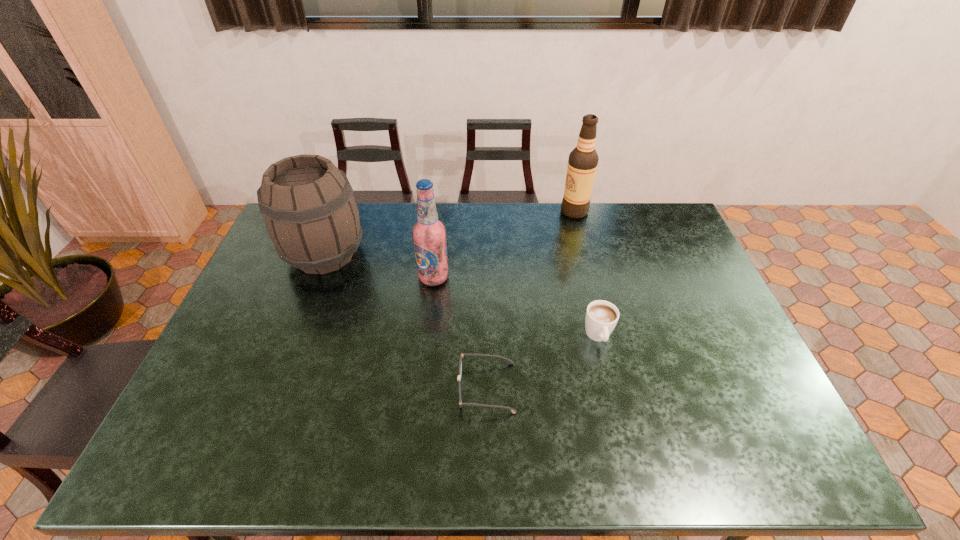
What are the coordinates of `vacant space that's between the left alcohol and the spectacles` in the screenshot? It's located at (460, 333).

Where is `vacant space in between the fourth object from right to left and the spectacles`? vacant space in between the fourth object from right to left and the spectacles is located at coordinates (460, 333).

Identify the location of vacant area that lies between the spectacles and the left alcohol. click(x=460, y=333).

Find the location of a particular element. vacant area that lies between the cappuccino and the spectacles is located at coordinates (542, 362).

Find the location of a particular element. The image size is (960, 540). vacant area that lies between the farthest object and the nearest object is located at coordinates (530, 299).

Where is `vacant space in between the spectacles and the second object from left to right`? The image size is (960, 540). vacant space in between the spectacles and the second object from left to right is located at coordinates (460, 333).

Locate an element on the screen. vacant region between the farther alcohol and the fourth tallest object is located at coordinates (587, 274).

Identify which object is the third nearest to the shortest object. Please provide its 2D coordinates. Your answer should be formatted as a tuple, i.e. [(x, y)], where the tuple contains the x and y coordinates of a point satisfying the conditions above.

[(311, 216)]

The width and height of the screenshot is (960, 540). I want to click on object that is the fourth closest to the spectacles, so click(582, 164).

Identify the location of free spot that satisfies the following two spatial constraints: 1. with the handle on the side of the cappuccino; 2. on the face of the shortest object. (611, 388).